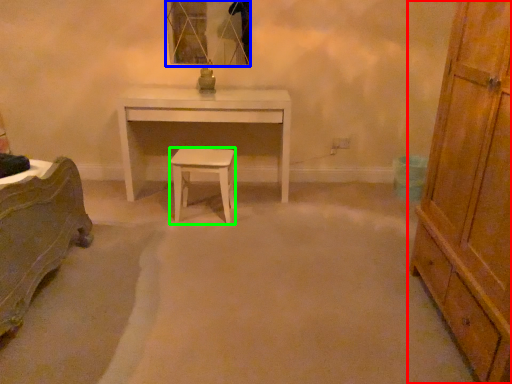
Question: Which object is positioned closest to chest of drawers (highlighted by a red box)? Select from mirror (highlighted by a blue box) and stool (highlighted by a green box).

Choices:
 (A) mirror
 (B) stool

Answer: (B)